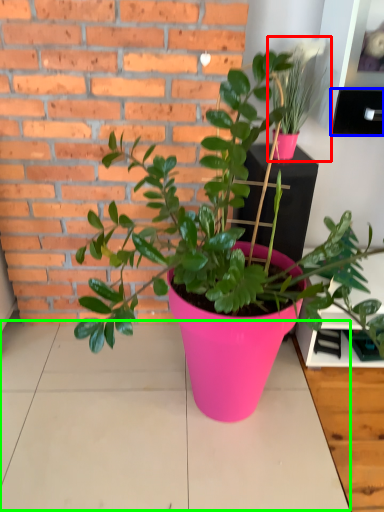
Question: Estimate the real-world distances between objects in this image. Which object is farther from houseplant (highlighted by a red box), shelf (highlighted by a blue box) or table top (highlighted by a green box)?

Choices:
 (A) shelf
 (B) table top

Answer: (B)